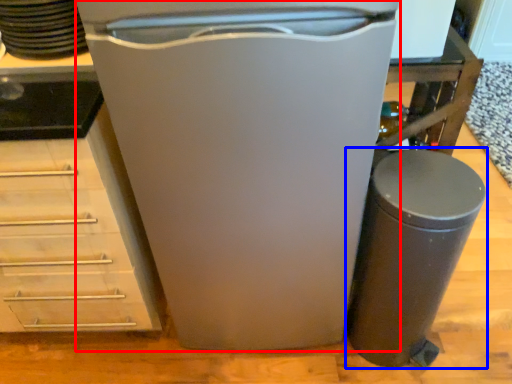
Question: Which of the following is the farthest to the observer, home appliance (highlighted by a red box) or waste container (highlighted by a blue box)?

Choices:
 (A) home appliance
 (B) waste container

Answer: (B)